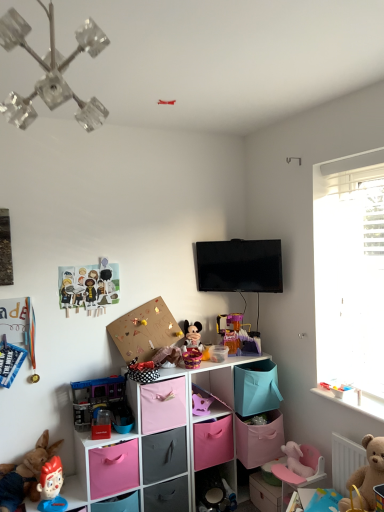
Question: Considering the positions of point (44, 487) and point (89, 453), is point (44, 487) closer or farther from the camera than point (89, 453)?

Choices:
 (A) farther
 (B) closer

Answer: (B)

Question: In terms of width, does matte plastic figurine at lower left, the first toy from the bottom, look wider or thinner when compared to pink fabric storage box at lower left, which is counted as the second storage box, starting from the bottom?

Choices:
 (A) wide
 (B) thin

Answer: (B)

Question: Based on their relative distances, which object is nearer to the pink fabric storage cubes at center, the second shelf in the top-to-bottom sequence?

Choices:
 (A) matte plastic figurine at lower left, placed as the tenth toy when sorted from top to bottom
 (B) flat screen tv at upper center
 (C) cardboard paper dolls at upper left, the 2th toy when ordered from top to bottom
 (D) pink fabric drawer at center, the second drawer positioned from the bottom
 (E) purple plastic castle at center, the third toy in the top-to-bottom sequence

Answer: (D)

Question: Which object is the closest to the clear crystal chandelier at upper left?

Choices:
 (A) pink fabric shelf at center, placed as the third shelf when sorted from bottom to top
 (B) plastic blue toy car at center, placed as the 6th toy when sorted from top to bottom
 (C) plastic toy figure at lower left, which is the third toy from bottom to top
 (D) translucent plastic toy at lower right, marked as the 5th toy in a top-to-bottom arrangement
 (E) pink fabric plush at lower right, which is the second toy in bottom-to-top order

Answer: (B)